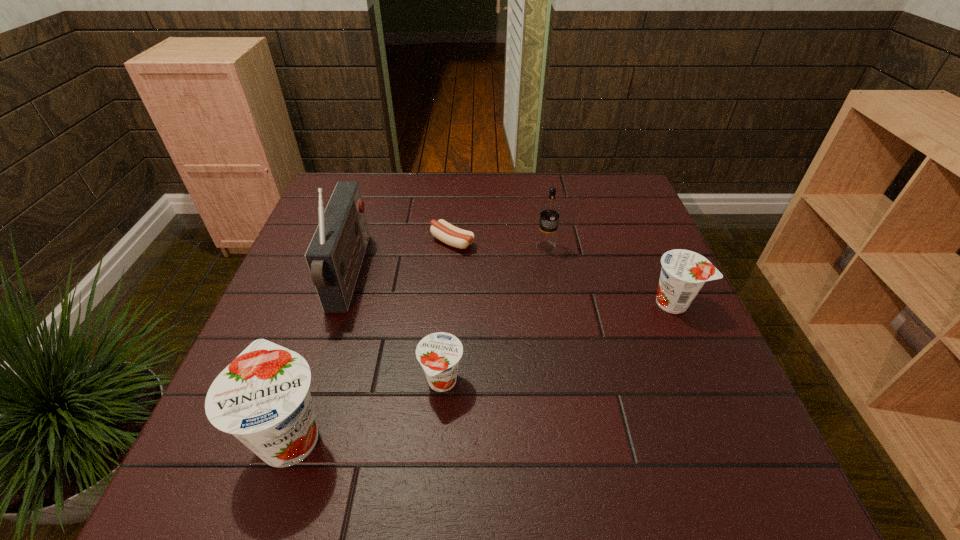
Image resolution: width=960 pixels, height=540 pixels. Identify the location of the tallest yogurt. (262, 397).

Locate an element on the screen. The height and width of the screenshot is (540, 960). the second yogurt from left to right is located at coordinates (439, 353).

Where is `the shortest yogurt`? the shortest yogurt is located at coordinates (439, 353).

Where is `the second tallest yogurt`? This screenshot has height=540, width=960. the second tallest yogurt is located at coordinates (684, 272).

At what (x,y) coordinates should I click in order to perform the action: click on the third shortest object. Please return your answer as a coordinate pair (x, y). Looking at the image, I should click on (684, 272).

Image resolution: width=960 pixels, height=540 pixels. Identify the location of sausage. (x=453, y=236).

Find the location of `the tallest object`. the tallest object is located at coordinates (335, 254).

Locate an element on the screen. the second object from right to left is located at coordinates pyautogui.click(x=550, y=210).

Identify the location of free space located 0.370m on the back of the leftmost yogurt. The height and width of the screenshot is (540, 960). (347, 266).

In order to click on free space located 0.090m on the left of the shortest yogurt in this screenshot , I will do `click(374, 382)`.